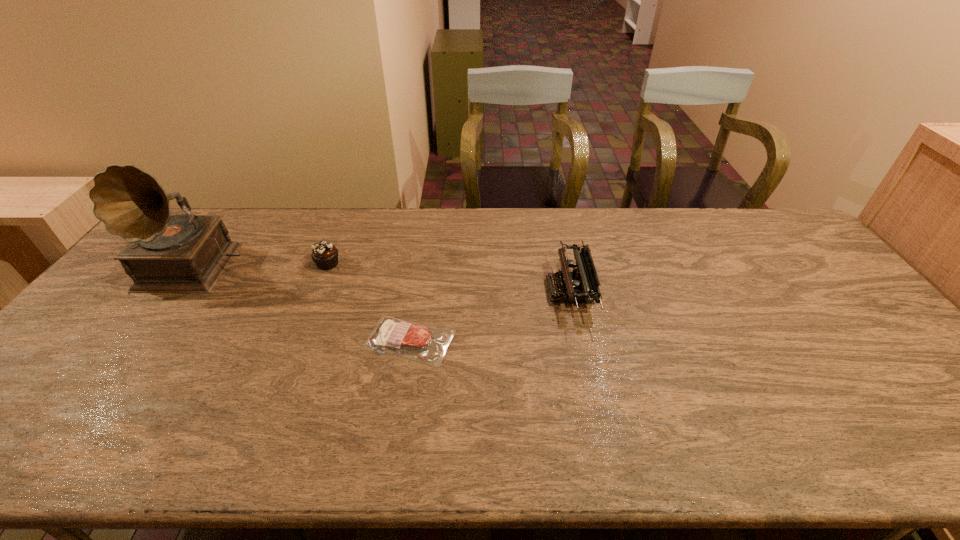
Locate an element on the screen. This screenshot has width=960, height=540. the closest object to the second tallest object is located at coordinates click(x=426, y=344).

Locate which object is the closest to the steak. Please provide its 2D coordinates. Your answer should be formatted as a tuple, i.e. [(x, y)], where the tuple contains the x and y coordinates of a point satisfying the conditions above.

[(325, 255)]